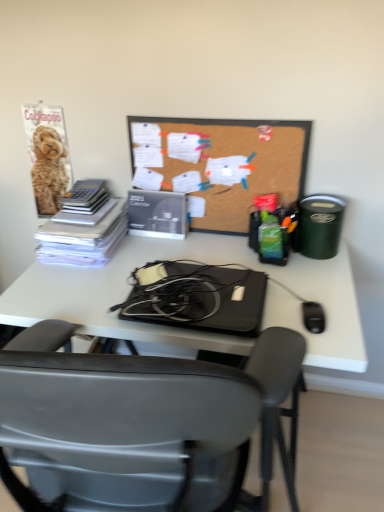
Where is `free spot to the right of white paper stack at left`? free spot to the right of white paper stack at left is located at coordinates (160, 245).